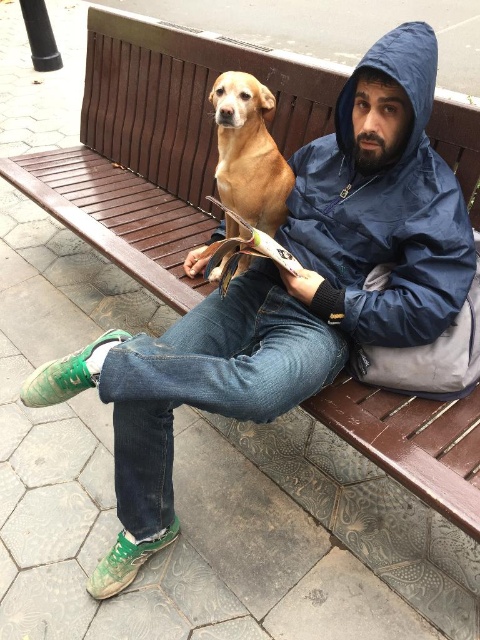
You are a hiker who needs to decide which item to take with you first. The blue waterproof jacket at upper right and the golden brown fur at center are both in your view. Which item is larger in size?

The blue waterproof jacket at upper right is bigger than the golden brown fur at center, so you should take the blue waterproof jacket at upper right first because it requires more space.

You are standing in front of the bench where the man and the dog are sitting. You want to place a small flower pot exactly at the point marked as point (423, 205). If your arm reaches 1.5 meters, can you comfortably place it there without moving closer?

The point (423, 205) is 1.38 meters from the viewer. Since your arm reaches 1.5 meters, you can comfortably place the flower pot there without moving closer.

You are a delivery robot that needs to place a package between the blue waterproof jacket at upper right and the golden brown fur at center. The package is 10 inches long. Will there be enough space?

The distance between the blue waterproof jacket at upper right and the golden brown fur at center is 9.56 inches. Since the package is 10 inches long, it will not fit in the available space.